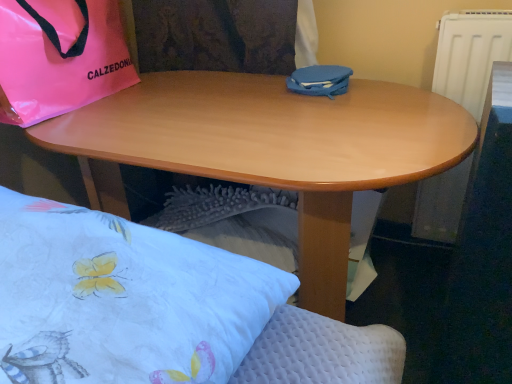
At what (x,y) coordinates should I click in order to perform the action: click on vacant space situated on the left part of blue matte case at center. Please return your answer as a coordinate pair (x, y). The height and width of the screenshot is (384, 512). Looking at the image, I should click on (251, 88).